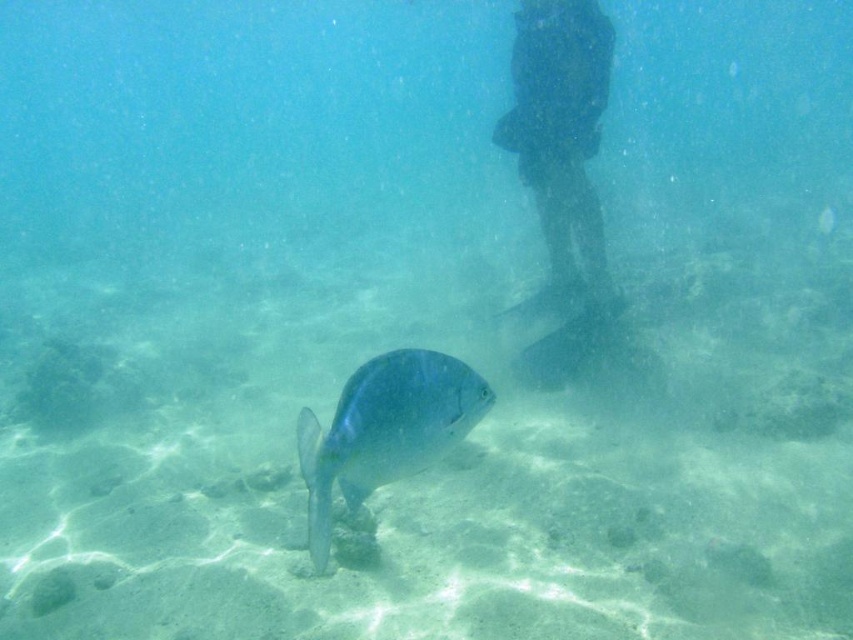
Does dark blue rubber boots at upper center come in front of shiny blue fish at center?

No, it is behind shiny blue fish at center.

Is dark blue rubber boots at upper center taller than shiny blue fish at center?

Yes.

Who is more forward, (541, 6) or (383, 422)?

Positioned in front is point (383, 422).

The image size is (853, 640). Identify the location of dark blue rubber boots at upper center. (561, 138).